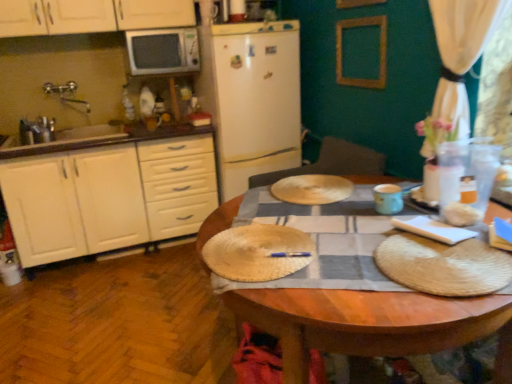
What are the coordinates of `vacant space in front of bamboo placemat at center` in the screenshot? It's located at (321, 294).